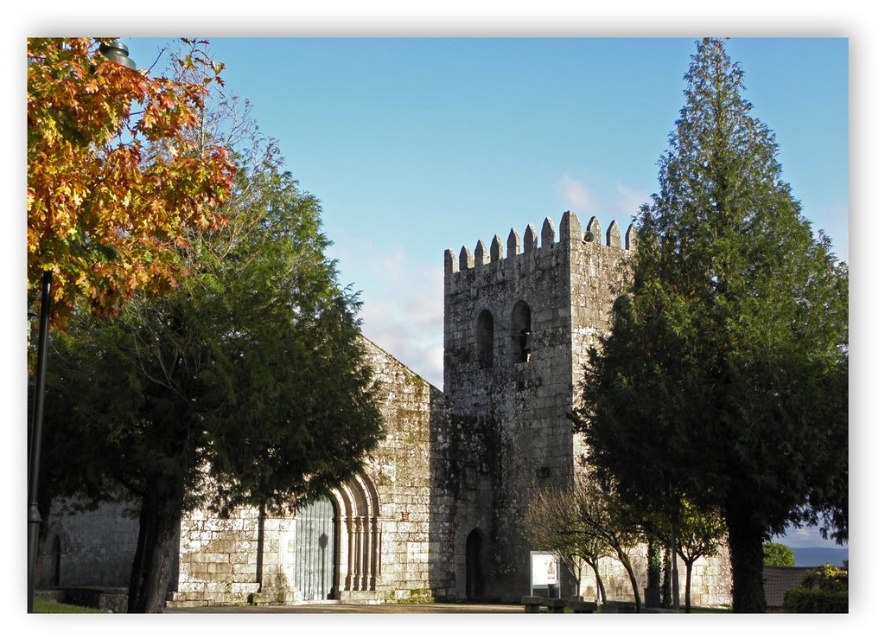
You are standing in front of the historic stone structure and want to place a decorative stone statue exactly at the location where the autumn leaves at left are currently located. What are the coordinates of the point where you should place the statue?

The autumn leaves at left are located at coordinates point (178, 308), so you should place the decorative stone statue at point (178, 308).

You are standing in front of the historic stone structure and notice autumn leaves at left and a white stone tower at center. Which object appears taller in the image?

The autumn leaves at left appears much taller than the white stone tower at center in the image.

From the picture: You are a drone operator who needs to fly a drone from the autumn leaves at left to the green textured tree at right. The drone has a maximum flight range of 20 meters. Based on the scene, can the drone reach the tree?

The distance between autumn leaves at left and green textured tree at right is 22.85 meters, which exceeds the drone maximum flight range of 20 meters. Therefore, the drone cannot reach the green textured tree at right.